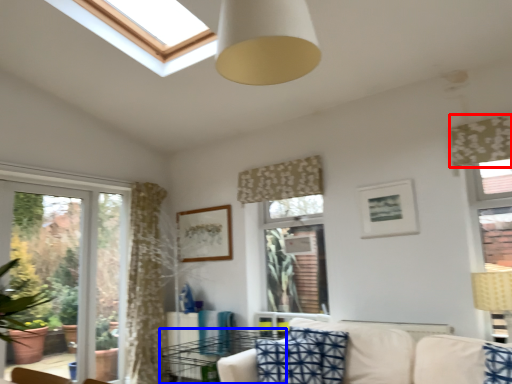
Question: Which of the following is the closest to the observer, curtain (highlighted by a red box) or table (highlighted by a blue box)?

Choices:
 (A) curtain
 (B) table

Answer: (A)